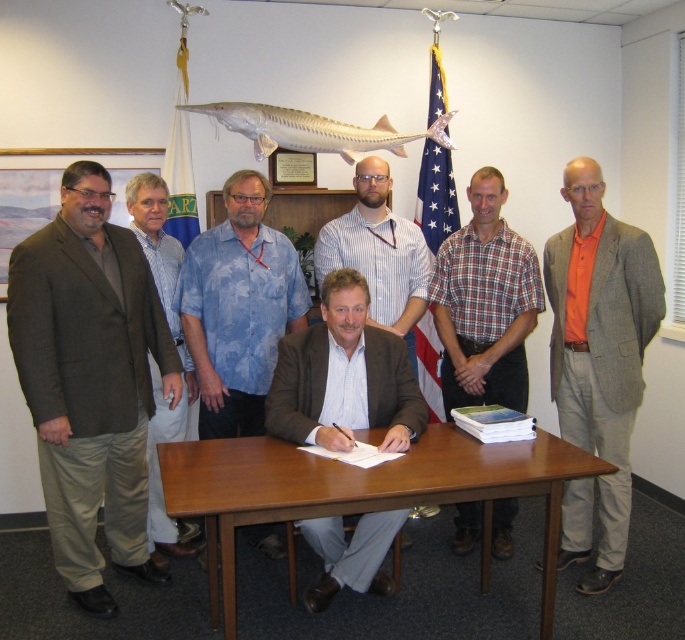
You are organizing a meeting and need to place a name tag on the brown wooden table at center and the orange cotton shirt at right. Which object requires a larger name tag based on their sizes?

The brown wooden table at center requires a larger name tag because it has a larger size compared to the orange cotton shirt at right.

You are a photographer adjusting the lighting for the group photo. You notice the brown wooden table at center and the orange cotton shirt at right. Which object is closer to the camera? Please explain your reasoning based on their positions.

The brown wooden table at center is positioned under the orange cotton shirt at right, meaning it is closer to the camera. Since the table is beneath the shirt, the photographer would see the table first in the depth of the scene.

You are a photographer adjusting the camera settings for the group photo. You need to ensure that both the brown fabric suit at left and the light brown suit at center are in focus. Which suit requires a larger depth of field adjustment to ensure clarity?

The light brown suit at center requires a larger depth of field adjustment because it is thicker than the brown fabric suit at left, necessitating more focus range to capture its details clearly.